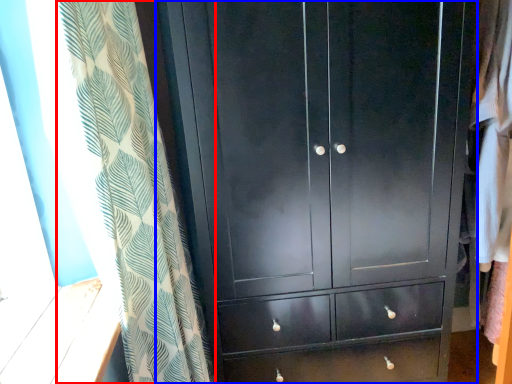
Question: Which point is closer to the camera, curtain (highlighted by a red box) or cupboard (highlighted by a blue box)?

Choices:
 (A) curtain
 (B) cupboard

Answer: (A)